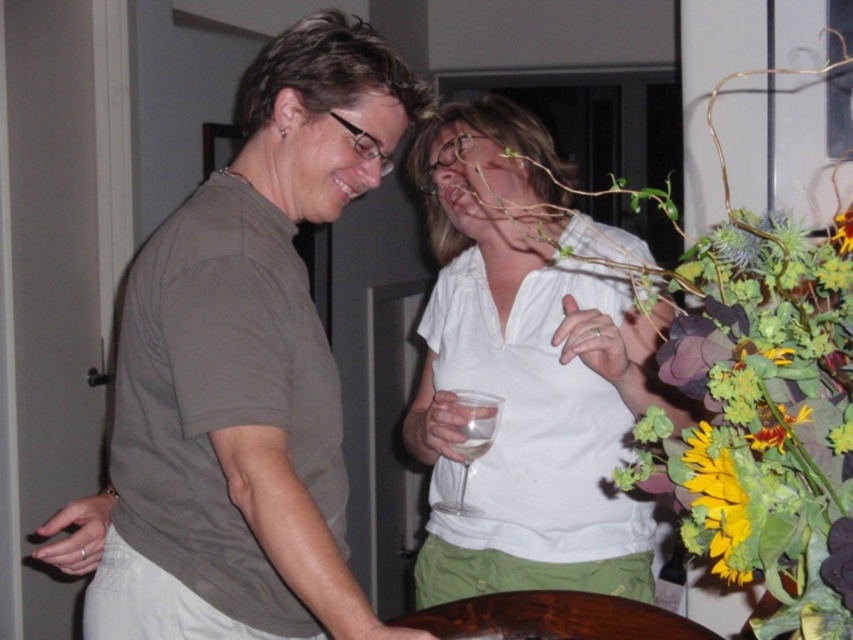
Between white matte shirt at center and yellow matte flower at upper right, which one appears on the left side from the viewer's perspective?

white matte shirt at center is more to the left.

Who is shorter, white matte shirt at center or yellow matte flower at upper right?

Standing shorter between the two is yellow matte flower at upper right.

The width and height of the screenshot is (853, 640). I want to click on white matte shirt at center, so (x=527, y=369).

Locate an element on the screen. The image size is (853, 640). white matte shirt at center is located at coordinates (527, 369).

Between white matte shirt at center and yellow matte flower at lower right, which one is positioned lower?

yellow matte flower at lower right

Who is shorter, white matte shirt at center or yellow matte flower at lower right?

yellow matte flower at lower right is shorter.

Who is more distant from viewer, (592, 240) or (737, 536)?

The point (592, 240) is behind.

The height and width of the screenshot is (640, 853). Identify the location of white matte shirt at center. point(527,369).

Who is positioned more to the left, brown polished wood table at lower center or clear glass wine glass at center?

From the viewer's perspective, clear glass wine glass at center appears more on the left side.

Where is `brown polished wood table at lower center`? This screenshot has width=853, height=640. brown polished wood table at lower center is located at coordinates (552, 618).

Which is in front, point (547, 611) or point (457, 486)?

Positioned in front is point (547, 611).

Locate an element on the screen. The width and height of the screenshot is (853, 640). brown polished wood table at lower center is located at coordinates (552, 618).